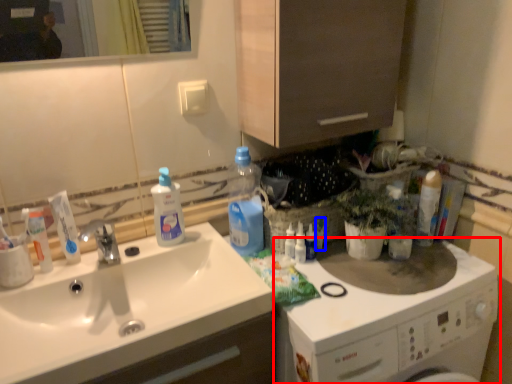
Question: Which of the following is the closest to the observer, washing machine (highlighted by a red box) or toiletry (highlighted by a blue box)?

Choices:
 (A) washing machine
 (B) toiletry

Answer: (A)